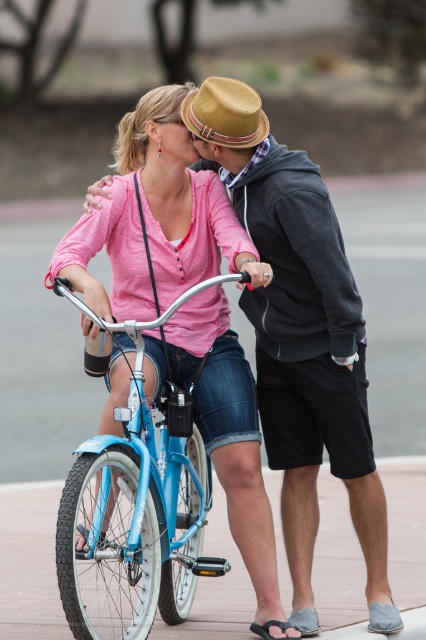
Who is positioned more to the left, matte pink shirt at center or blue metallic bicycle at center?

blue metallic bicycle at center

Does matte pink shirt at center appear on the right side of blue metallic bicycle at center?

Yes, matte pink shirt at center is to the right of blue metallic bicycle at center.

Is point (199, 134) positioned in front of point (176, 454)?

That is True.

Where is `matte pink shirt at center`? matte pink shirt at center is located at coordinates (298, 333).